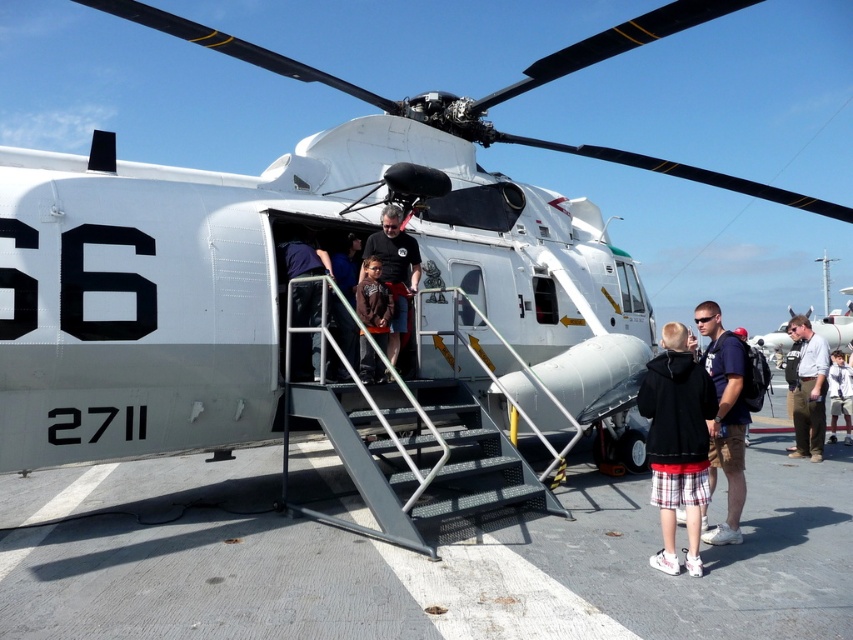
You are a photographer trying to capture a clear shot of both the dark brown leather jacket at center and the white shirt at right. Based on their heights, which one might you need to adjust your camera angle upwards to include in the frame?

The dark brown leather jacket at center has a lesser height compared to the white shirt at right, so you would need to adjust your camera angle upwards to include the taller white shirt at right in the frame.